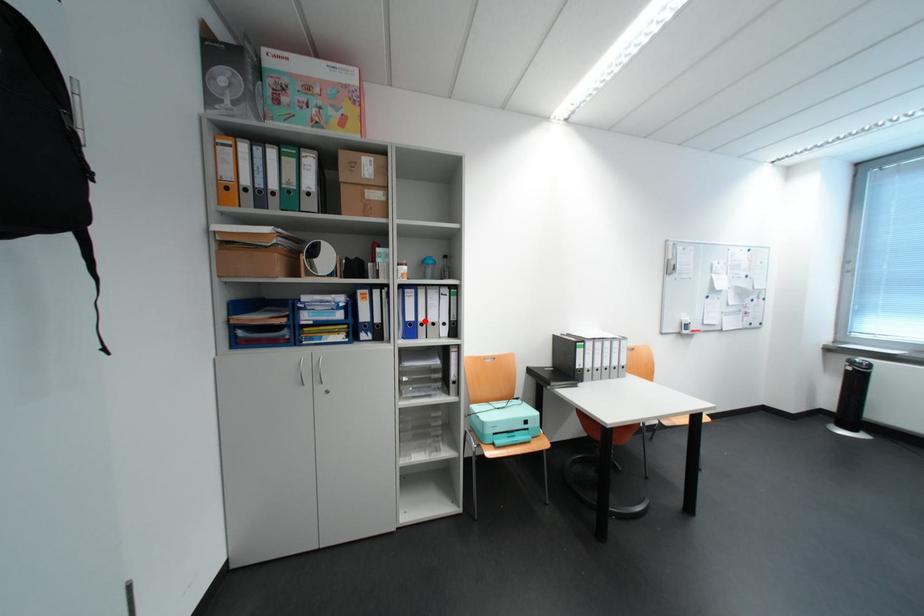
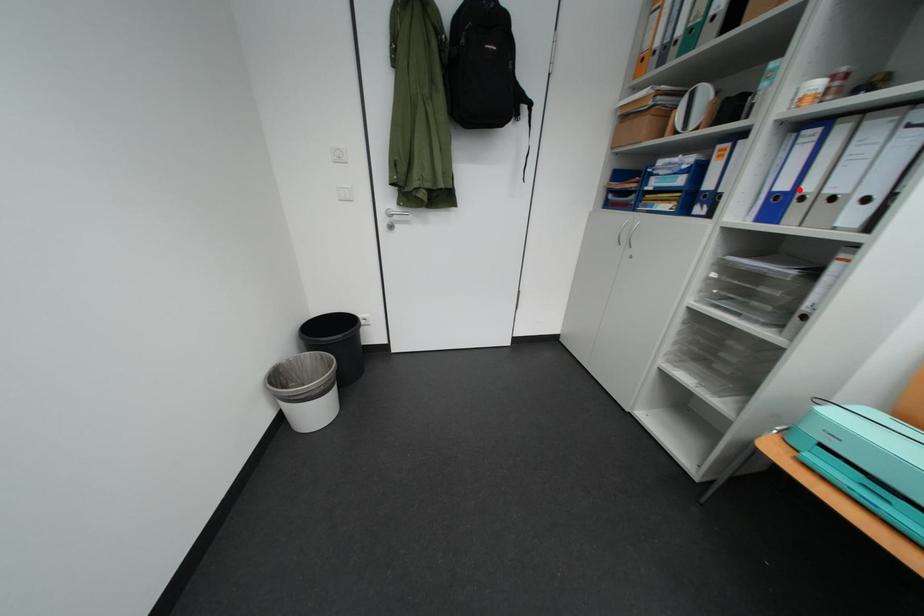
Looking at this image, I am providing you with two images of the same scene from different viewpoints. A red point is marked on the first image and another point is marked on the second image. Is the red point in image1 aligned with the point shown in image2?

Yes